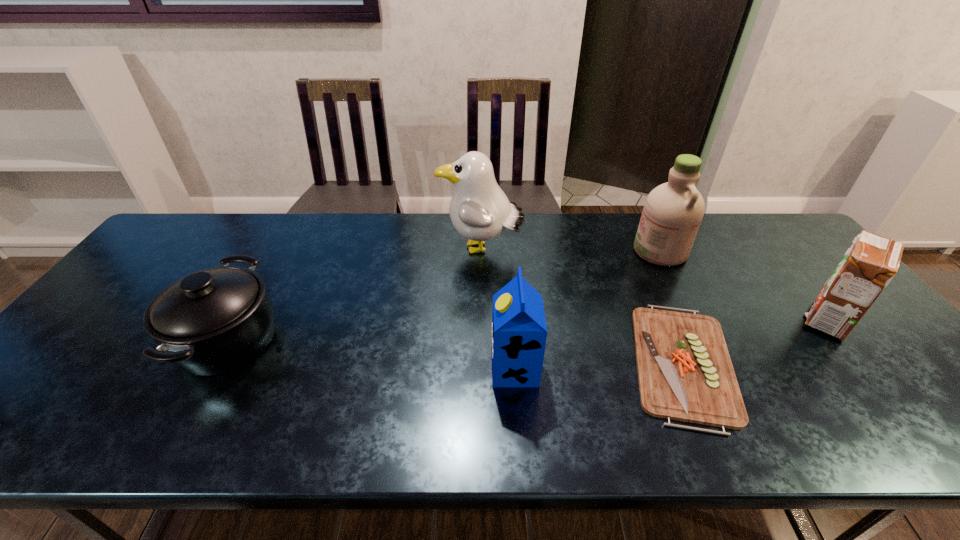
Find the location of a particular element. vacant area situated 0.400m on the beak of the gull is located at coordinates (312, 250).

The width and height of the screenshot is (960, 540). What are the coordinates of `vacant space located on the front label of the cleansing agent` in the screenshot? It's located at (592, 251).

I want to click on vacant area situated on the front label of the cleansing agent, so click(573, 251).

You are a GUI agent. You are given a task and a screenshot of the screen. Output one action in this format:
    pyautogui.click(x=<x>, y=<y>)
    Task: Click on the vacant region located 0.320m on the front label of the cleansing agent
    The height and width of the screenshot is (540, 960).
    Given the screenshot: What is the action you would take?
    pyautogui.click(x=532, y=251)

At what (x,y) coordinates should I click in order to perform the action: click on free space located with the cap open on the left carton. Please return your answer as a coordinate pair (x, y). This screenshot has width=960, height=540. Looking at the image, I should click on (415, 368).

At what (x,y) coordinates should I click in order to perform the action: click on free spot located 0.210m with the cap open on the left carton. Please return your answer as a coordinate pair (x, y). The height and width of the screenshot is (540, 960). Looking at the image, I should click on (402, 368).

The height and width of the screenshot is (540, 960). Find the location of `free space located 0.050m with the cap open on the left carton`. free space located 0.050m with the cap open on the left carton is located at coordinates (470, 368).

Where is `vacant space located 0.190m on the straw side of the right carton`? This screenshot has width=960, height=540. vacant space located 0.190m on the straw side of the right carton is located at coordinates (726, 320).

This screenshot has height=540, width=960. I want to click on free space located 0.340m on the straw side of the right carton, so click(x=669, y=320).

Locate an element on the screen. Image resolution: width=960 pixels, height=540 pixels. vacant region located on the straw side of the right carton is located at coordinates (710, 320).